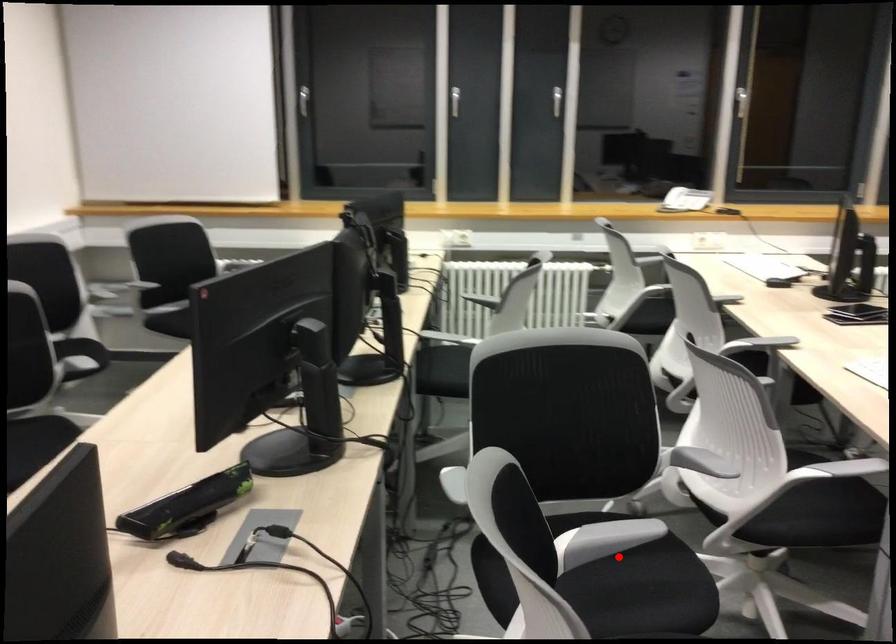
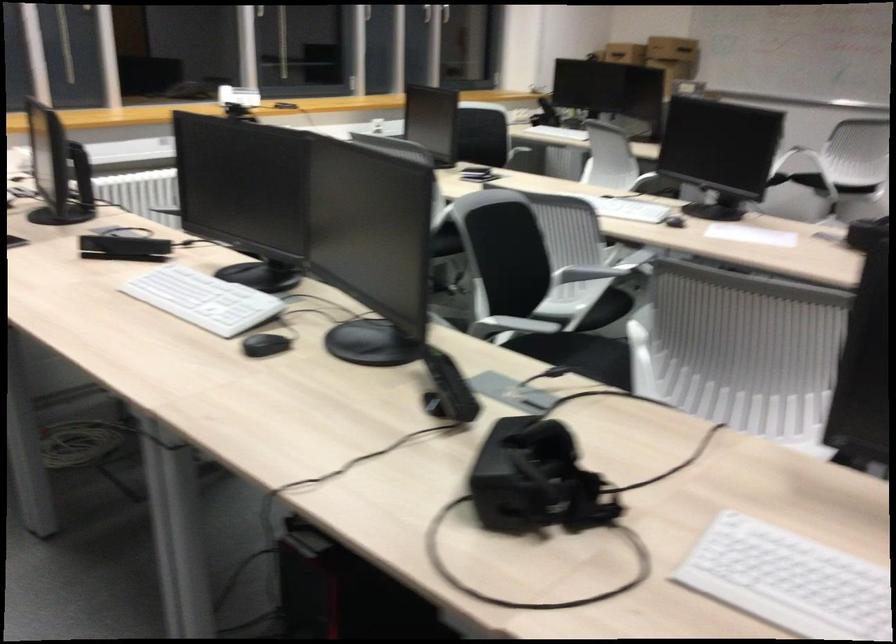
Question: A red point is marked in image1. In image2, is the corresponding 3D point closer to the camera or farther? Reply with the corresponding letter.

Choices:
 (A) The corresponding 3D point is closer.
 (B) The corresponding 3D point is farther.

Answer: (B)